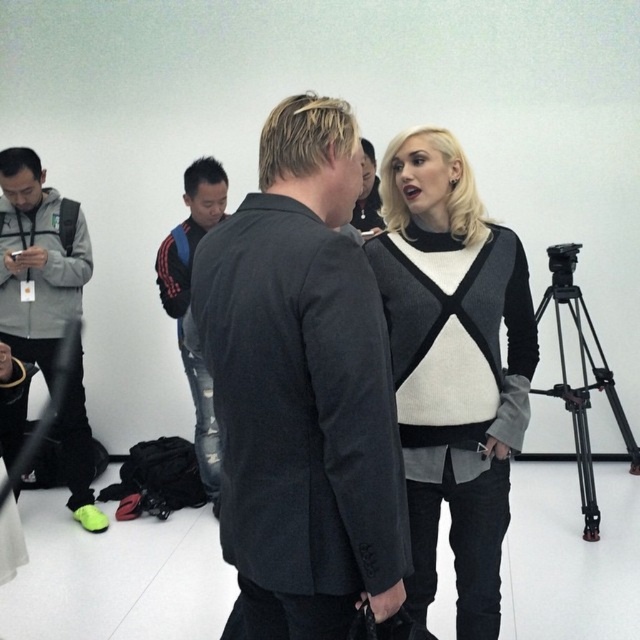
Question: Can you confirm if dark gray suit at center is thinner than knit sweater at center?

Choices:
 (A) yes
 (B) no

Answer: (A)

Question: Which point is farther to the camera?

Choices:
 (A) (586, 358)
 (B) (356, 515)
 (C) (426, 332)

Answer: (A)

Question: Among these objects, which one is farthest from the camera?

Choices:
 (A) gray fleece jacket at left
 (B) knit sweater at center
 (C) black metal tripod at right

Answer: (C)

Question: Which of the following is the farthest from the observer?

Choices:
 (A) (582, 308)
 (B) (49, 323)
 (C) (346, 141)

Answer: (A)

Question: Is dark gray suit at center to the right of knit sweater at center from the viewer's perspective?

Choices:
 (A) no
 (B) yes

Answer: (A)

Question: Can you confirm if blue/red striped hoodie at center is positioned above black metal tripod at right?

Choices:
 (A) no
 (B) yes

Answer: (B)